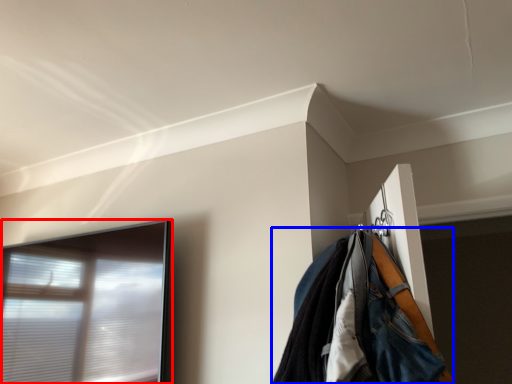
Question: Among these objects, which one is nearest to the camera, window (highlighted by a red box) or jacket (highlighted by a blue box)?

Choices:
 (A) window
 (B) jacket

Answer: (B)